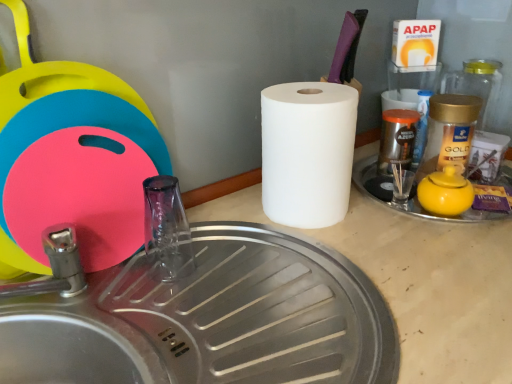
Where is `spots to the right of transparent glass faucet at center`? This screenshot has width=512, height=384. spots to the right of transparent glass faucet at center is located at coordinates (268, 269).